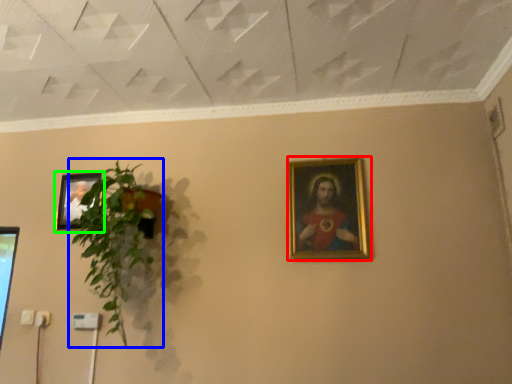
Question: Considering the real-world distances, which object is farthest from picture frame (highlighted by a red box)? houseplant (highlighted by a blue box) or picture frame (highlighted by a green box)?

Choices:
 (A) houseplant
 (B) picture frame

Answer: (B)